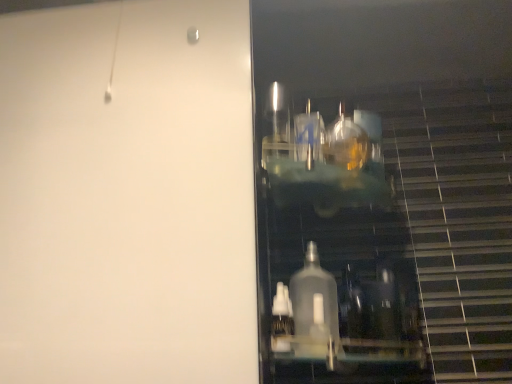
Question: Can you confirm if clear plastic bottle at lower center is thinner than transparent plastic bottles at right?

Choices:
 (A) no
 (B) yes

Answer: (B)

Question: Is clear plastic bottle at lower center positioned in front of transparent plastic bottles at right?

Choices:
 (A) no
 (B) yes

Answer: (A)

Question: Can you confirm if clear plastic bottle at lower center is smaller than transparent plastic bottles at right?

Choices:
 (A) yes
 (B) no

Answer: (A)

Question: Is clear plastic bottle at lower center positioned behind transparent plastic bottles at right?

Choices:
 (A) no
 (B) yes

Answer: (B)

Question: Is clear plastic bottle at lower center to the left of transparent plastic bottles at right from the viewer's perspective?

Choices:
 (A) yes
 (B) no

Answer: (A)

Question: From the image's perspective, is transparent plastic bottles at right positioned above or below transparent glass door at right?

Choices:
 (A) below
 (B) above

Answer: (A)

Question: Is transparent plastic bottles at right to the left or to the right of transparent glass door at right in the image?

Choices:
 (A) right
 (B) left

Answer: (A)

Question: From their relative heights in the image, would you say transparent plastic bottles at right is taller or shorter than transparent glass door at right?

Choices:
 (A) short
 (B) tall

Answer: (A)

Question: Relative to transparent glass door at right, is transparent plastic bottles at right in front or behind?

Choices:
 (A) front
 (B) behind

Answer: (B)

Question: Is transparent glass door at right taller or shorter than clear plastic bottle at lower center?

Choices:
 (A) tall
 (B) short

Answer: (A)

Question: Looking at the image, does transparent glass door at right seem bigger or smaller compared to clear plastic bottle at lower center?

Choices:
 (A) small
 (B) big

Answer: (B)

Question: Is transparent glass door at right situated inside clear plastic bottle at lower center or outside?

Choices:
 (A) inside
 (B) outside

Answer: (B)

Question: Relative to clear plastic bottle at lower center, is transparent glass door at right in front or behind?

Choices:
 (A) front
 (B) behind

Answer: (A)

Question: Considering their positions, is transparent plastic bottles at right located in front of or behind clear plastic bottle at lower center?

Choices:
 (A) behind
 (B) front

Answer: (B)

Question: Visually, is transparent plastic bottles at right positioned to the left or to the right of clear plastic bottle at lower center?

Choices:
 (A) right
 (B) left

Answer: (A)